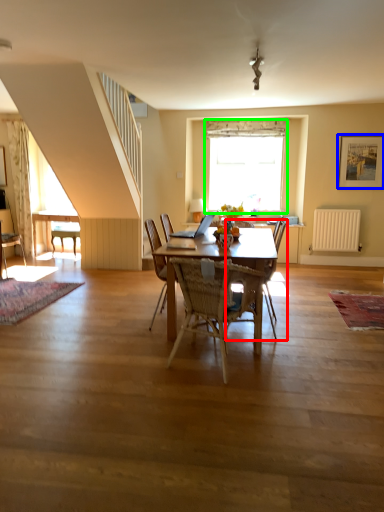
Question: Which is farther away from armchair (highlighted by a red box)? picture frame (highlighted by a blue box) or window (highlighted by a green box)?

Choices:
 (A) picture frame
 (B) window

Answer: (A)